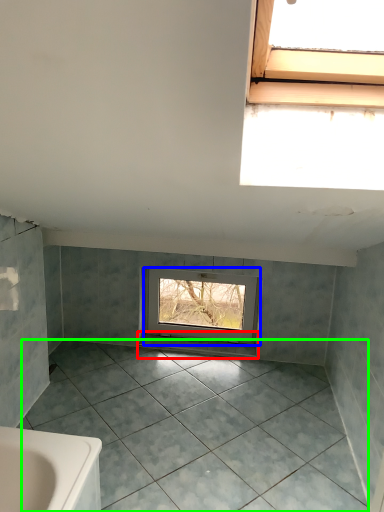
Question: Estimate the real-world distances between objects in this image. Which object is farther from window sill (highlighted by a red box), window (highlighted by a blue box) or ceramic tile (highlighted by a green box)?

Choices:
 (A) window
 (B) ceramic tile

Answer: (B)